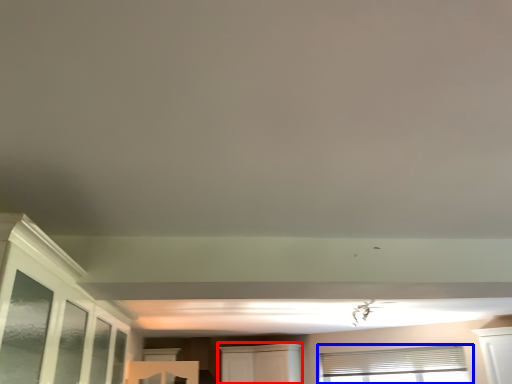
Question: Which object appears closest to the camera in this image, cabinetry (highlighted by a red box) or window (highlighted by a blue box)?

Choices:
 (A) cabinetry
 (B) window

Answer: (B)